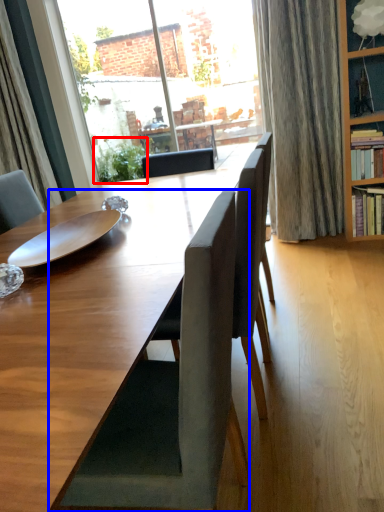
Question: Which of the following is the farthest to the observer, plant (highlighted by a red box) or chair (highlighted by a blue box)?

Choices:
 (A) plant
 (B) chair

Answer: (A)